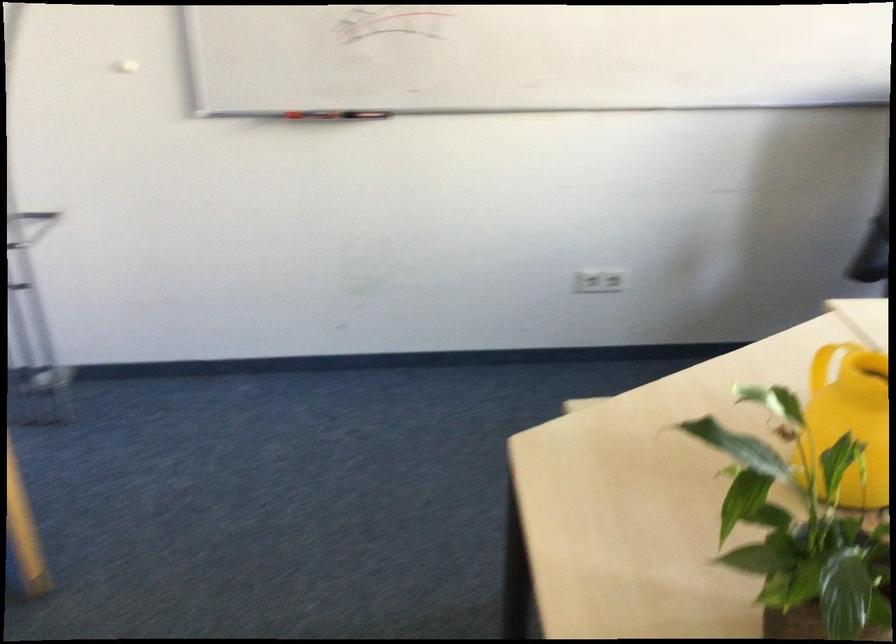
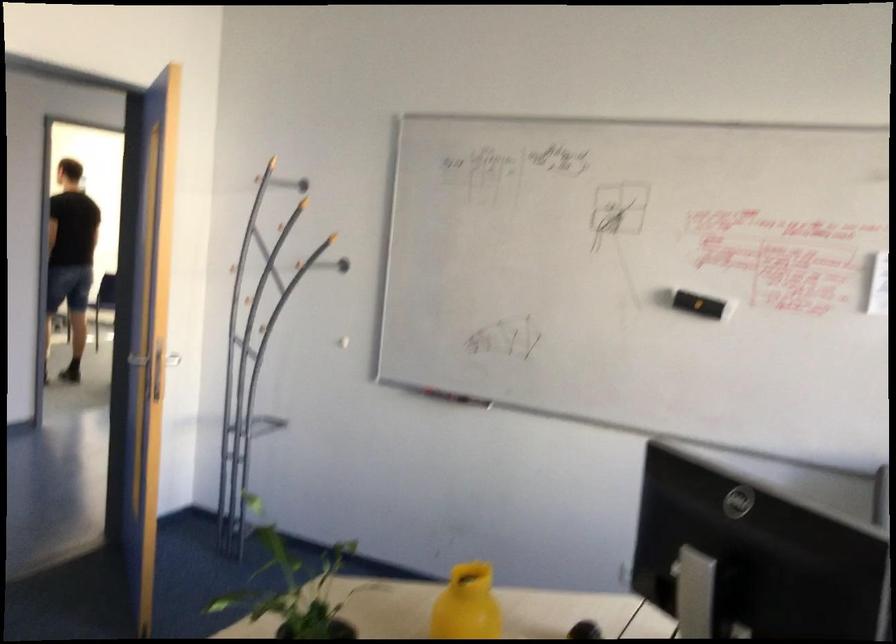
Find the pixel in the second image that matches point (334, 128) in the first image.

(452, 397)